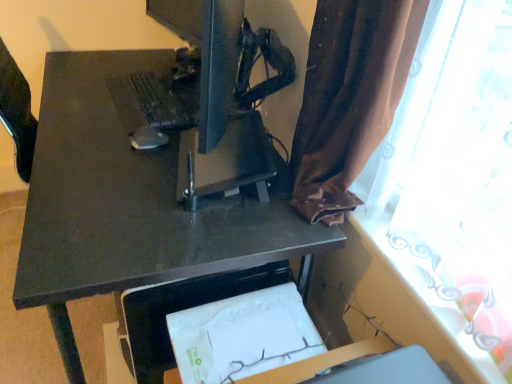
At what (x,y) coordinates should I click in order to perform the action: click on vacant area located to the right-hand side of matte black mouse at center. Please return your answer as a coordinate pair (x, y). Looking at the image, I should click on (172, 150).